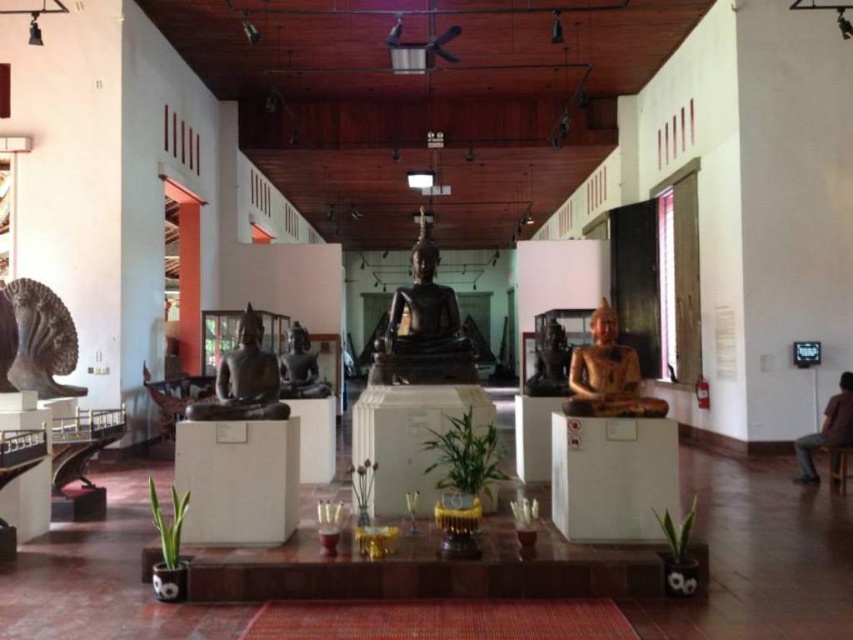
You are a museum visitor who wants to take a photo of both the matte black statue at left and the gold polished statue at center. Since you have a wide angle lens, you need to know which statue is bigger to frame your shot properly. Which statue is larger?

The matte black statue at left is larger in size than the gold polished statue at center, so you should frame the matte black statue at left first as it is bigger.

You are an art curator planning to move a new sculpture that is 1.5 meters tall into the museum. The sculpture must be placed between the black polished statue at center and the matte black statue at left. Considering their sizes, will there be enough vertical space between them to accommodate the new sculpture without it touching either?

The black polished statue at center is larger than the matte black statue at left. Since the new sculpture is 1.5 meters tall, and the existing statues vary in height, there should be sufficient vertical space between them to place the new sculpture without it touching either, provided the pedestals allow for such placement.

You are standing in the museum and want to locate the matte black statue at left. What are the coordinates where you can find it?

The matte black statue at left can be found at coordinates point (242,380).